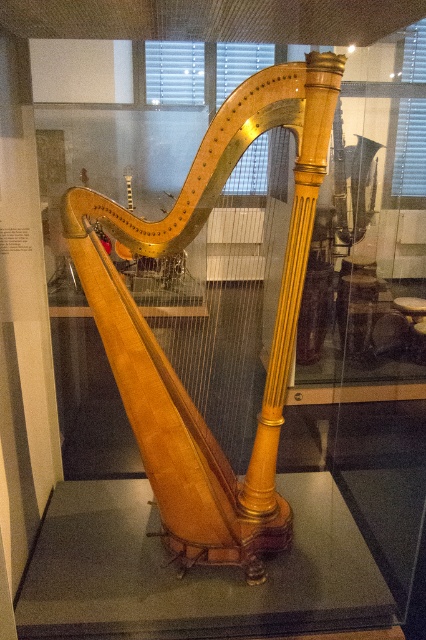
Which of these two, wooden harp at center or transparent glass table at center, stands taller?

wooden harp at center

Does wooden harp at center appear on the right side of transparent glass table at center?

Incorrect, wooden harp at center is not on the right side of transparent glass table at center.

Is point (276, 326) closer to viewer compared to point (132, 554)?

Yes, it is.

This screenshot has width=426, height=640. I want to click on wooden harp at center, so click(x=161, y=348).